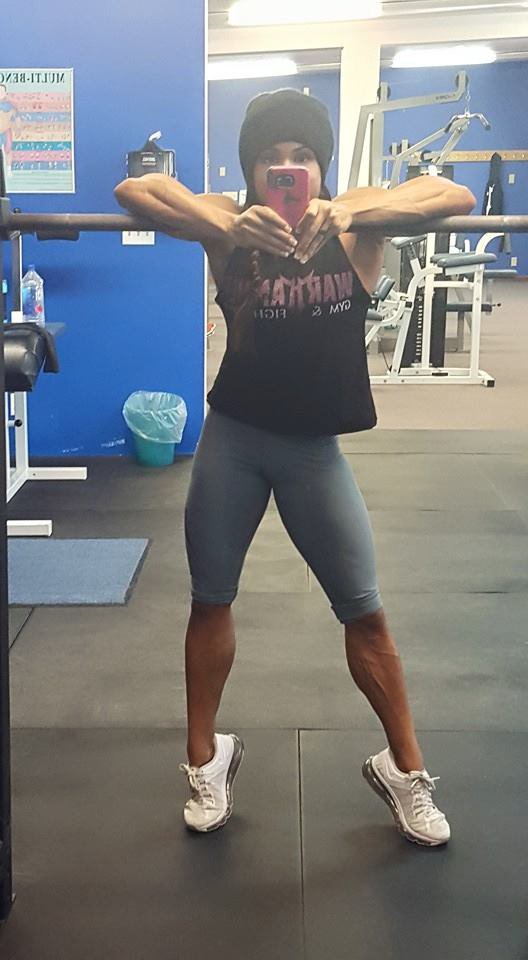
Where is `towel dispenser`? This screenshot has width=528, height=960. towel dispenser is located at coordinates (148, 159).